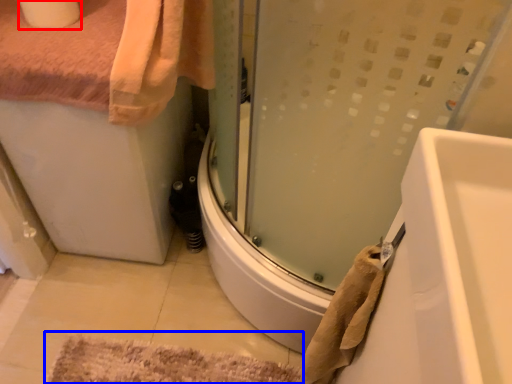
Question: Which of the following is the farthest to the observer, toilet paper (highlighted by a red box) or bath mat (highlighted by a blue box)?

Choices:
 (A) toilet paper
 (B) bath mat

Answer: (B)